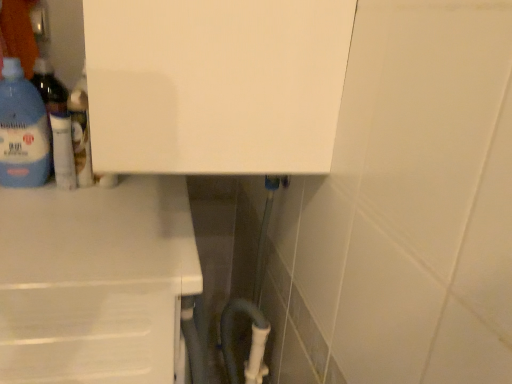
The height and width of the screenshot is (384, 512). In order to click on blank space situated above white matte counter at lower left (from a real-world perspective) in this screenshot , I will do `click(88, 210)`.